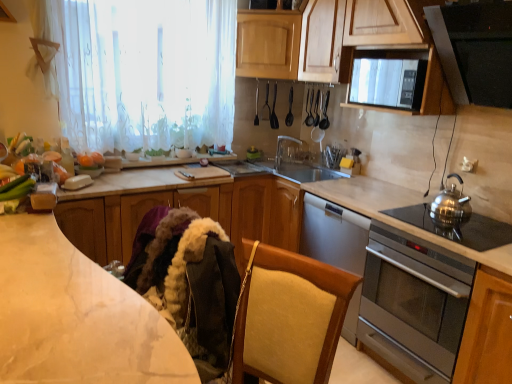
Question: Is marble at left, which is the second countertop in back-to-front order, positioned in front of clear plastic tap at center?

Choices:
 (A) no
 (B) yes

Answer: (B)

Question: Could you tell me if marble at left, which is the second countertop in back-to-front order, is turned towards clear plastic tap at center?

Choices:
 (A) yes
 (B) no

Answer: (A)

Question: Considering the relative sizes of marble at left, marked as the first countertop in a front-to-back arrangement, and clear plastic tap at center in the image provided, is marble at left, marked as the first countertop in a front-to-back arrangement, wider than clear plastic tap at center?

Choices:
 (A) yes
 (B) no

Answer: (A)

Question: Is marble at left, which is the second countertop in back-to-front order, far from clear plastic tap at center?

Choices:
 (A) yes
 (B) no

Answer: (A)

Question: From a real-world perspective, is marble at left, which is the second countertop in back-to-front order, beneath clear plastic tap at center?

Choices:
 (A) no
 (B) yes

Answer: (B)

Question: Is white marble countertop at center, acting as the 1th countertop starting from the back, to the left or to the right of black plastic spoon at upper center, which is counted as the 1th appliance, starting from the right, in the image?

Choices:
 (A) right
 (B) left

Answer: (B)

Question: From the image's perspective, is white marble countertop at center, acting as the 1th countertop starting from the back, above or below black plastic spoon at upper center, which is counted as the 1th appliance, starting from the right?

Choices:
 (A) above
 (B) below

Answer: (B)

Question: Considering the positions of white marble countertop at center, acting as the 1th countertop starting from the back, and black plastic spoon at upper center, acting as the second appliance starting from the left, in the image, is white marble countertop at center, acting as the 1th countertop starting from the back, wider or thinner than black plastic spoon at upper center, acting as the second appliance starting from the left,?

Choices:
 (A) thin
 (B) wide

Answer: (B)

Question: In the image, is white marble countertop at center, acting as the 1th countertop starting from the back, positioned in front of or behind black plastic spoon at upper center, which is counted as the 1th appliance, starting from the right?

Choices:
 (A) front
 (B) behind

Answer: (A)

Question: Does point (264, 72) appear closer or farther from the camera than point (298, 147)?

Choices:
 (A) closer
 (B) farther

Answer: (A)

Question: Looking at the image, does wooden cabinet at upper center, arranged as the 1th cabinetry when viewed from the top, seem bigger or smaller compared to clear plastic tap at center?

Choices:
 (A) big
 (B) small

Answer: (A)

Question: Considering their positions, is wooden cabinet at upper center, the fourth cabinetry ordered from the bottom, located in front of or behind clear plastic tap at center?

Choices:
 (A) behind
 (B) front

Answer: (B)

Question: From the image's perspective, relative to clear plastic tap at center, is wooden cabinet at upper center, arranged as the 1th cabinetry when viewed from the top, above or below?

Choices:
 (A) below
 (B) above

Answer: (B)

Question: Is metallic silver spoon at upper center, positioned as the 1th appliance in left-to-right order, inside the boundaries of white sheer curtain at upper left, or outside?

Choices:
 (A) outside
 (B) inside

Answer: (A)

Question: Visually, is metallic silver spoon at upper center, positioned as the 1th appliance in left-to-right order, positioned to the left or to the right of white sheer curtain at upper left?

Choices:
 (A) right
 (B) left

Answer: (A)